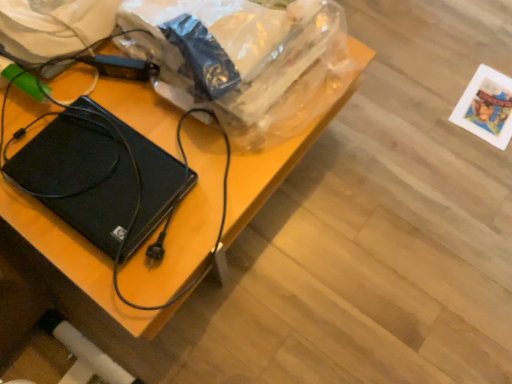
Locate an element on the screen. The width and height of the screenshot is (512, 384). vacant space that's between black matte laptop at left and plastic bag at upper center is located at coordinates (150, 142).